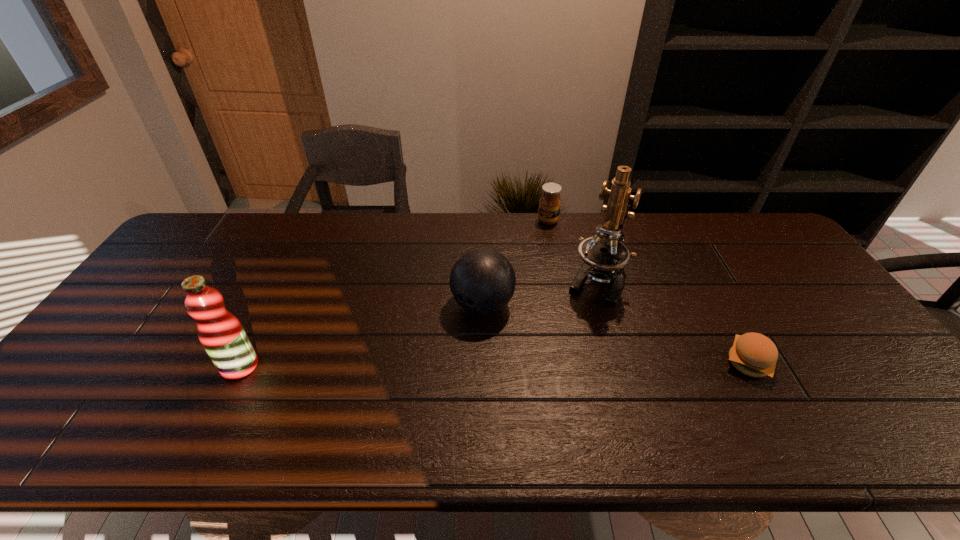
Identify the location of free spot on the desktop that is between the leftmost object and the rightmost object and is positioned at the eyepiece of the microscope. (554, 364).

Find the location of a particular element. The width and height of the screenshot is (960, 540). free space on the desktop that is between the leftmost object and the hamburger and is positioned on the front-facing side of the second shortest object is located at coordinates (494, 364).

Locate an element on the screen. The width and height of the screenshot is (960, 540). free space on the desktop that is between the leftmost object and the hamburger and is positioned on the grip area of the fourth object from right to left is located at coordinates (429, 364).